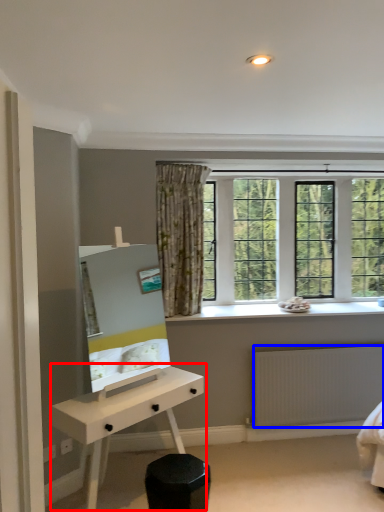
Question: Which point is closer to the camera, desk (highlighted by a red box) or radiator (highlighted by a blue box)?

Choices:
 (A) desk
 (B) radiator

Answer: (A)